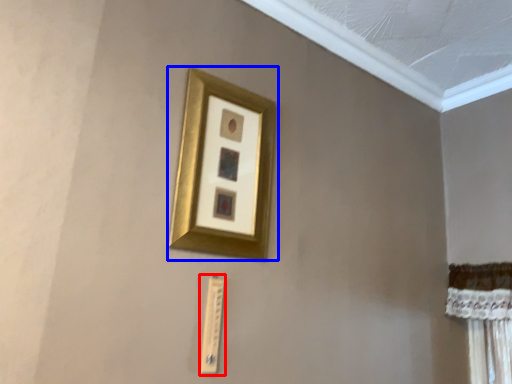
Question: Among these objects, which one is farthest to the camera, light switch (highlighted by a red box) or picture frame (highlighted by a blue box)?

Choices:
 (A) light switch
 (B) picture frame

Answer: (A)